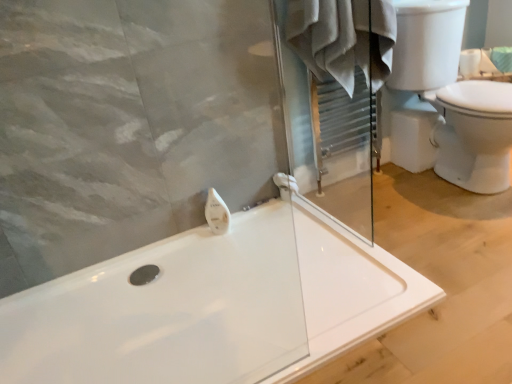
The height and width of the screenshot is (384, 512). I want to click on free space in front of white plastic towel bar at center, so click(283, 218).